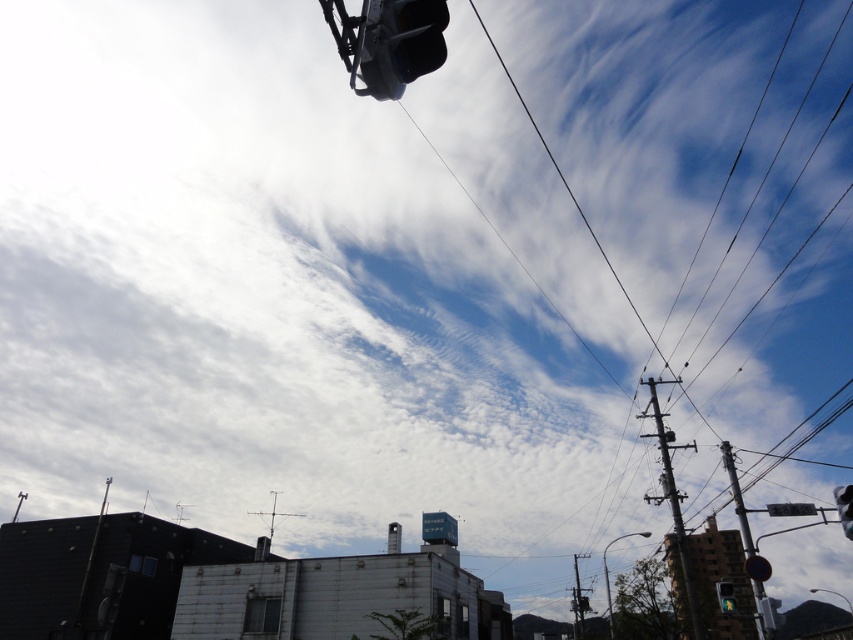
Question: Is black plastic traffic light at upper center positioned at the back of metallic gray pole at right?

Choices:
 (A) no
 (B) yes

Answer: (A)

Question: Which of the following is the closest to the observer?

Choices:
 (A) metallic pole at right
 (B) matte black traffic light at upper center

Answer: (A)

Question: Which of these objects is positioned farthest from the black plastic traffic light at upper center?

Choices:
 (A) matte black traffic light at upper center
 (B) metallic silver traffic light at upper right
 (C) metallic pole at right

Answer: (A)

Question: Can you confirm if black plastic traffic light at upper center is bigger than metallic gray pole at right?

Choices:
 (A) yes
 (B) no

Answer: (B)

Question: Is metallic silver traffic light at upper right smaller than matte black traffic light at upper center?

Choices:
 (A) no
 (B) yes

Answer: (A)

Question: Among these points, which one is farthest from the camera?

Choices:
 (A) (654, 381)
 (B) (732, 596)

Answer: (A)